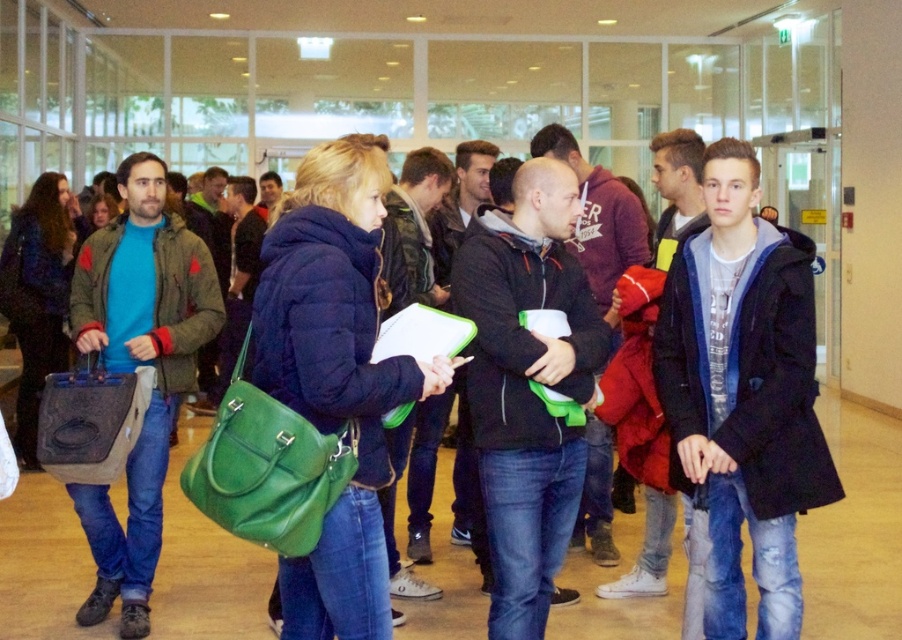
Question: Is dark blue textured coat at center thinner than matte green bag at center?

Choices:
 (A) yes
 (B) no

Answer: (A)

Question: Which point is closer to the camera taking this photo?

Choices:
 (A) (327, 404)
 (B) (739, 600)

Answer: (A)

Question: Does dark blue textured coat at center have a smaller size compared to matte green bag at center?

Choices:
 (A) no
 (B) yes

Answer: (B)

Question: Is dark blue textured coat at center positioned in front of matte green bag at center?

Choices:
 (A) yes
 (B) no

Answer: (B)

Question: Which point is farther from the camera taking this photo?

Choices:
 (A) (353, 544)
 (B) (730, 275)

Answer: (B)